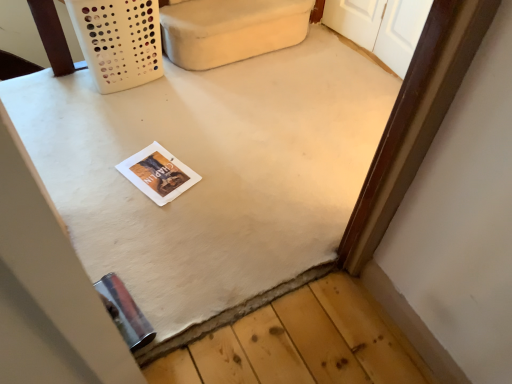
This screenshot has height=384, width=512. Identify the location of free space behind white paper magazine at center. (164, 131).